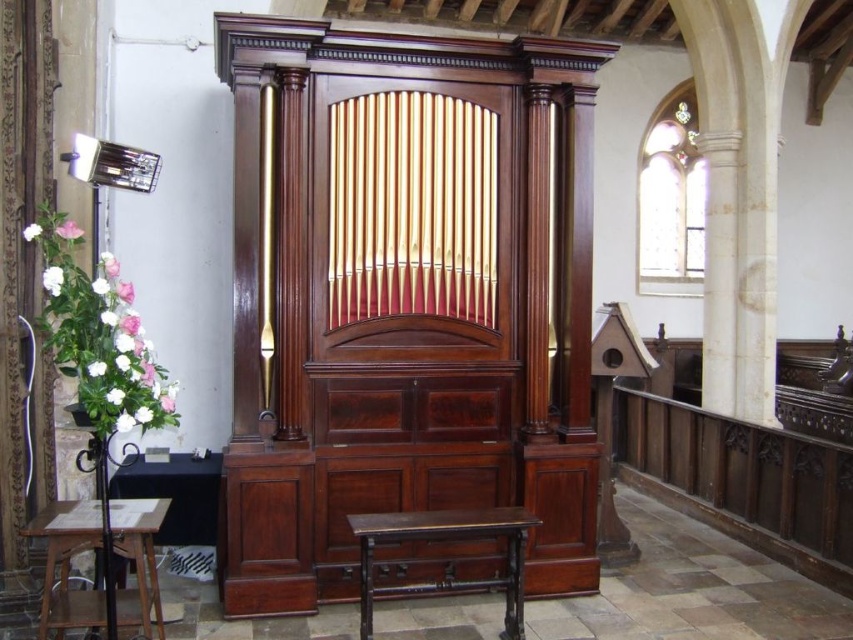
You are an organist preparing to play. You see a dark brown wooden stool at center and a wooden stool at lower left. Which stool should you sit on to be closer to the organ?

You should sit on the dark brown wooden stool at center because it is positioned to the right of the wooden stool at lower left, placing it closer to the organ.

You are an interior designer planning to place a new rug in the church. The rug must be large enough to cover both the mahogany wood organ at center and the wooden stool at lower left. Based on the scene description, can you determine if the rug is sufficient in size?

The mahogany wood organ at center is larger in size than the wooden stool at lower left. Therefore, the rug must be at least as large as the organ to cover both objects. However, without knowing the exact dimensions of the rug, it is impossible to confirm if it is sufficient.

You are an organist preparing to play a piece. You need to sit on the dark brown wooden stool at center. Where exactly should you position yourself relative to the mahogany wood organ at center?

You should position yourself in front of the mahogany wood organ at center, as the dark brown wooden stool at center is located below it.